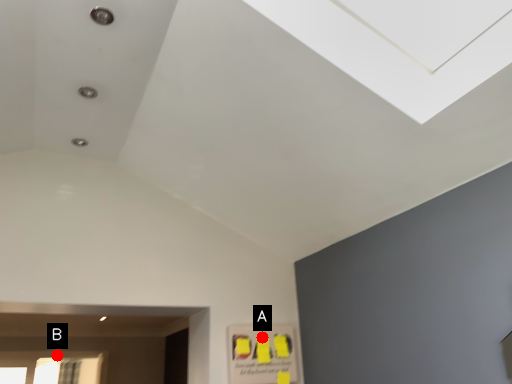
Question: Two points are circled on the image, labeled by A and B beside each circle. Which point is further to the camera?

Choices:
 (A) A is further
 (B) B is further

Answer: (B)